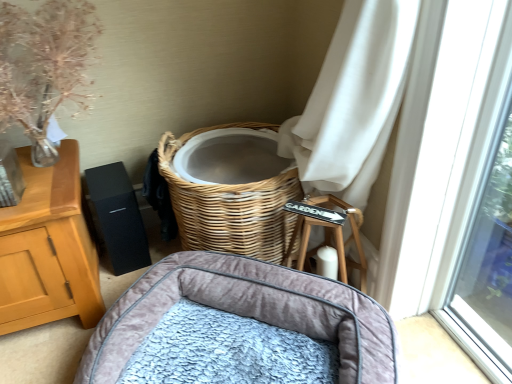
Locate an element on the screen. The height and width of the screenshot is (384, 512). translucent glass vase at upper left is located at coordinates (44, 66).

Image resolution: width=512 pixels, height=384 pixels. What do you see at coordinates (44, 66) in the screenshot?
I see `translucent glass vase at upper left` at bounding box center [44, 66].

You are a GUI agent. You are given a task and a screenshot of the screen. Output one action in this format:
    pyautogui.click(x=<x>, y=<y>)
    Task: Click on the velvet grey pet bed at lower center
    Image resolution: width=512 pixels, height=384 pixels.
    Given the screenshot: What is the action you would take?
    coord(239,327)

This screenshot has height=384, width=512. What do you see at coordinates (239, 327) in the screenshot?
I see `velvet grey pet bed at lower center` at bounding box center [239, 327].

You are a GUI agent. You are given a task and a screenshot of the screen. Output one action in this format:
    pyautogui.click(x=<x>, y=<y>)
    Task: Click on the translucent glass vase at upper left
    This screenshot has width=512, height=384.
    Given the screenshot: What is the action you would take?
    pyautogui.click(x=44, y=66)

In the image, is velvet grey pet bed at lower center on the left side or the right side of translucent glass vase at upper left?

velvet grey pet bed at lower center is to the right of translucent glass vase at upper left.

Which object is more forward, velvet grey pet bed at lower center or translucent glass vase at upper left?

velvet grey pet bed at lower center.

Is point (366, 314) closer to viewer compared to point (41, 99)?

Yes, it is.

From the image's perspective, which is above, velvet grey pet bed at lower center or translucent glass vase at upper left?

From the image's view, translucent glass vase at upper left is above.

From a real-world perspective, does velvet grey pet bed at lower center stand above translucent glass vase at upper left?

No.

In terms of width, does velvet grey pet bed at lower center look wider or thinner when compared to translucent glass vase at upper left?

Considering their sizes, velvet grey pet bed at lower center looks broader than translucent glass vase at upper left.

Is velvet grey pet bed at lower center taller or shorter than translucent glass vase at upper left?

velvet grey pet bed at lower center is shorter than translucent glass vase at upper left.

Who is bigger, velvet grey pet bed at lower center or translucent glass vase at upper left?

velvet grey pet bed at lower center is bigger.

Would you say velvet grey pet bed at lower center is inside or outside translucent glass vase at upper left?

The correct answer is: outside.

From the picture: Is velvet grey pet bed at lower center positioned far away from translucent glass vase at upper left?

No, there isn't a large distance between velvet grey pet bed at lower center and translucent glass vase at upper left.

Could you tell me if velvet grey pet bed at lower center is facing translucent glass vase at upper left?

No, velvet grey pet bed at lower center does not turn towards translucent glass vase at upper left.

This screenshot has width=512, height=384. In order to click on floral arrangement behind the velvet grey pet bed at lower center in this screenshot , I will do `click(44, 66)`.

Is translucent glass vase at upper left at the left side of velvet grey pet bed at lower center?

Yes.

From the picture: Is translucent glass vase at upper left positioned in front of velvet grey pet bed at lower center?

No, translucent glass vase at upper left is further to the viewer.

Is point (30, 105) closer to camera compared to point (343, 335)?

That is False.

From the image's perspective, is translucent glass vase at upper left located above or below velvet grey pet bed at lower center?

translucent glass vase at upper left is above velvet grey pet bed at lower center.

From a real-world perspective, is translucent glass vase at upper left positioned over velvet grey pet bed at lower center based on gravity?

Yes.

Can you confirm if translucent glass vase at upper left is wider than velvet grey pet bed at lower center?

Incorrect, the width of translucent glass vase at upper left does not surpass that of velvet grey pet bed at lower center.

In the scene shown: Is translucent glass vase at upper left taller than velvet grey pet bed at lower center?

Yes.

Based on the photo, is translucent glass vase at upper left smaller than velvet grey pet bed at lower center?

Yes.

Would you say velvet grey pet bed at lower center is part of translucent glass vase at upper left's contents?

No, velvet grey pet bed at lower center is not surrounded by translucent glass vase at upper left.

Does translucent glass vase at upper left touch velvet grey pet bed at lower center?

translucent glass vase at upper left and velvet grey pet bed at lower center are not in contact.

In the scene shown: Is translucent glass vase at upper left facing away from velvet grey pet bed at lower center?

No, translucent glass vase at upper left's orientation is not away from velvet grey pet bed at lower center.

Find the location of a particular element. This screenshot has width=512, height=384. floral arrangement above the velvet grey pet bed at lower center (from a real-world perspective) is located at coordinates (44, 66).

This screenshot has height=384, width=512. In order to click on infant bed beneath the translucent glass vase at upper left (from a real-world perspective) in this screenshot , I will do `click(239, 327)`.

Locate an element on the screen. floral arrangement that is above the velvet grey pet bed at lower center (from a real-world perspective) is located at coordinates (44, 66).